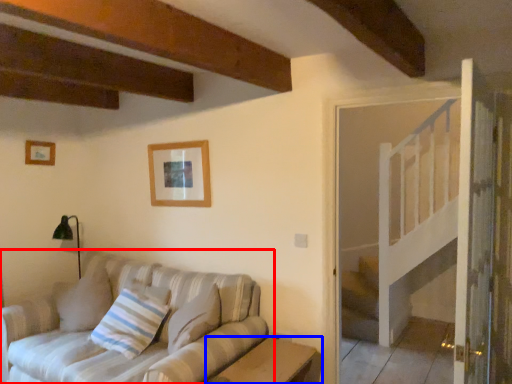
Question: Among these objects, which one is farthest to the camera, studio couch (highlighted by a red box) or table (highlighted by a blue box)?

Choices:
 (A) studio couch
 (B) table

Answer: (B)